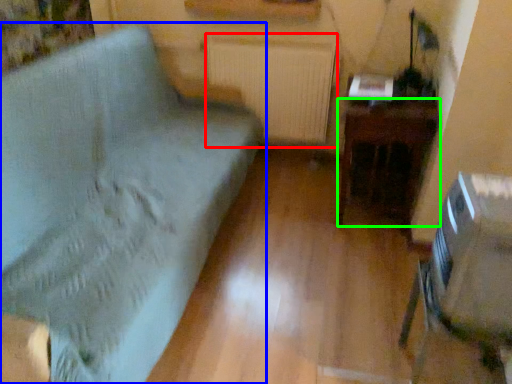
Question: Which object is positioned farthest from radiator (highlighted by a red box)? Select from furniture (highlighted by a blue box) and table (highlighted by a green box).

Choices:
 (A) furniture
 (B) table

Answer: (A)